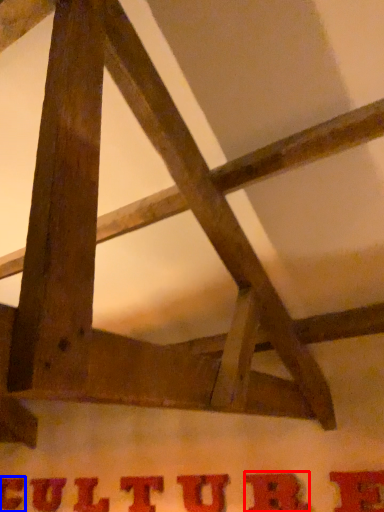
Question: Which object is closer to the camera taking this photo, letter (highlighted by a red box) or letter (highlighted by a blue box)?

Choices:
 (A) letter
 (B) letter

Answer: (A)